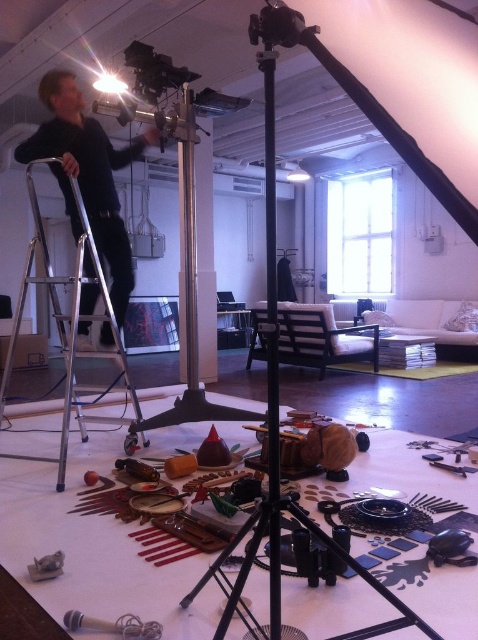
You are a photographer setting up a shoot in this workspace. You need to adjust the lighting so that the black fabric man at left casts a shadow on the silver metallic ladder at left. Is this possible given their positions?

The black fabric man at left is located above the silver metallic ladder at left, so when light is directed downward, the shadow of the black fabric man at left will naturally fall onto the silver metallic ladder at left. Therefore, adjusting the lighting to cast downward light would achieve this effect.

You are standing at the center of the room and see the point marked at coordinates (86, 176). What object is located at that point?

The point at coordinates (86, 176) marks the location of the black fabric man at left.